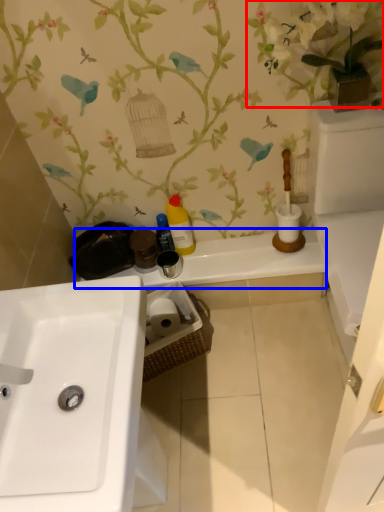
Question: Which object appears farthest to the camera in this image, floral arrangement (highlighted by a red box) or counter top (highlighted by a blue box)?

Choices:
 (A) floral arrangement
 (B) counter top

Answer: (B)